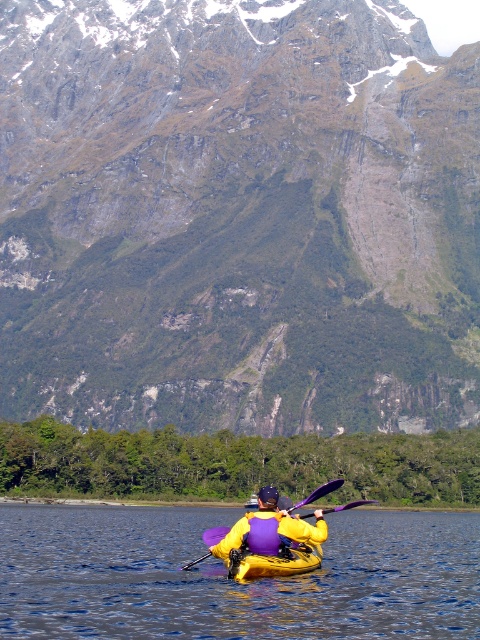
Question: Which point is farther to the camera?

Choices:
 (A) (320, 563)
 (B) (16, 592)
 (C) (342, 416)

Answer: (C)

Question: Is green rock at upper center bigger than yellow fabric kayak at center?

Choices:
 (A) no
 (B) yes

Answer: (B)

Question: Can you confirm if green rock at upper center is positioned to the right of blue water at center?

Choices:
 (A) no
 (B) yes

Answer: (A)

Question: Does blue water at center appear on the left side of yellow fabric kayak at center?

Choices:
 (A) no
 (B) yes

Answer: (A)

Question: Which object is the closest to the yellow fabric kayak at center?

Choices:
 (A) green rock at upper center
 (B) blue water at center

Answer: (B)

Question: Based on their relative distances, which object is nearer to the blue water at center?

Choices:
 (A) green rock at upper center
 (B) yellow fabric kayak at center

Answer: (B)